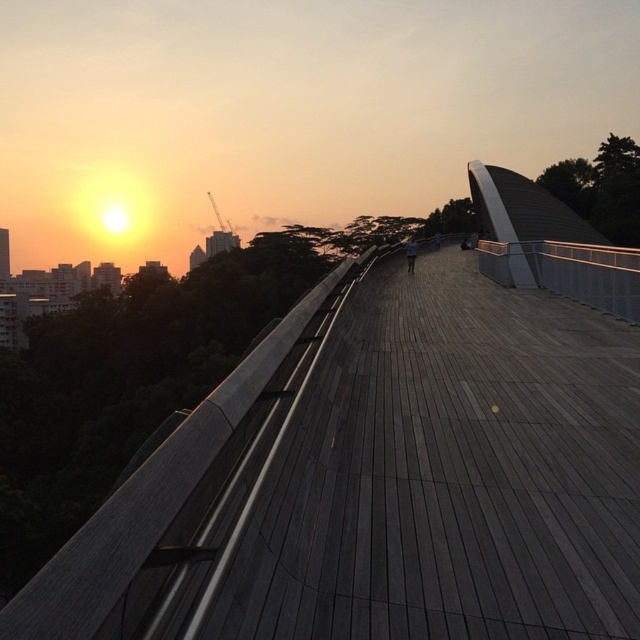
You are standing on the wooden walkway and notice two items at the center of the scene. The dark gray fabric at center and the dark blue jeans at center. Which item is closer to you?

The dark gray fabric at center is closer to you because it is in front of the dark blue jeans at center.

You are standing on the wooden walkway and want to reach a dark gray fabric at center. There is also a dark blue jeans at center nearby. How far apart are these two items from each other?

The dark gray fabric at center and dark blue jeans at center are 14.43 meters apart from each other.

You are standing on the wooden walkway and notice two items at the center of the scene. The items are the dark gray fabric at center and the dark blue jeans at center. Which item takes up more space in the scene?

The dark gray fabric at center is larger in size than the dark blue jeans at center, so it takes up more space in the scene.